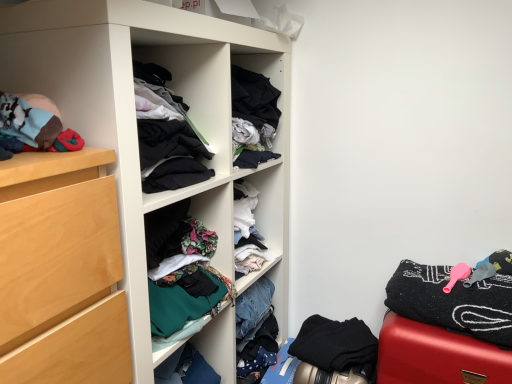
Question: Is point (455, 372) closer or farther from the camera than point (343, 324)?

Choices:
 (A) farther
 (B) closer

Answer: (B)

Question: From the image's perspective, is smooth red suitcase at lower right positioned above or below black matte fabric at lower right, which is the first clothing in bottom-to-top order?

Choices:
 (A) below
 (B) above

Answer: (B)

Question: Which object is positioned closest to the matte white cupboard at center?

Choices:
 (A) black textured towel at right, placed as the 1th clothing when sorted from top to bottom
 (B) black matte fabric at lower right, arranged as the second clothing when viewed from the top
 (C) smooth red suitcase at lower right

Answer: (B)

Question: Which object is the closest to the matte white cupboard at center?

Choices:
 (A) black textured towel at right, which ranks as the 2th clothing in bottom-to-top order
 (B) smooth red suitcase at lower right
 (C) black matte fabric at lower right, which is the first clothing in bottom-to-top order

Answer: (C)